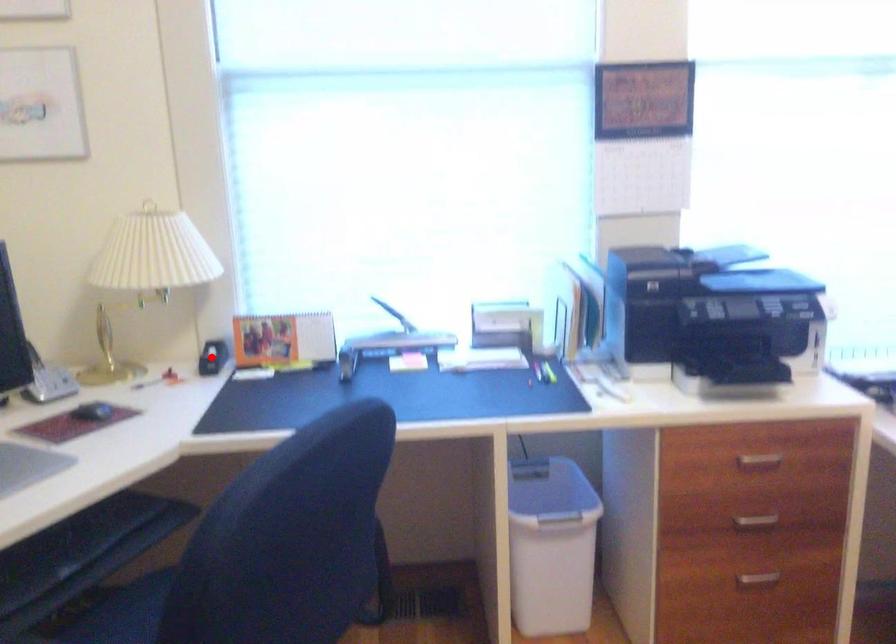
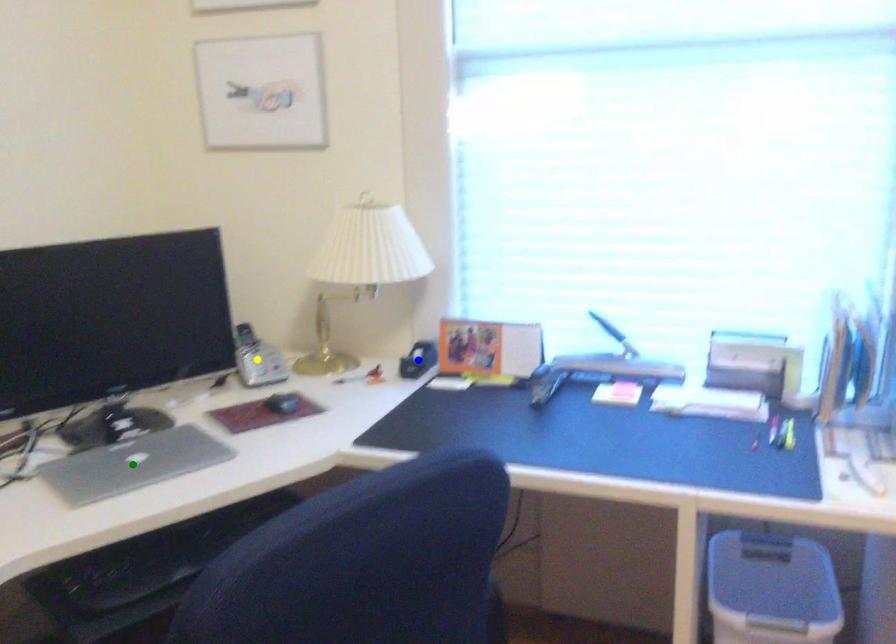
Question: I am providing you with two images of the same scene from different viewpoints. A red point is marked on the first image. You are given multiple points on the second image. Which point in image 2 is actually the same real-world point as the red point in image 1?

Choices:
 (A) blue point
 (B) green point
 (C) yellow point

Answer: (A)